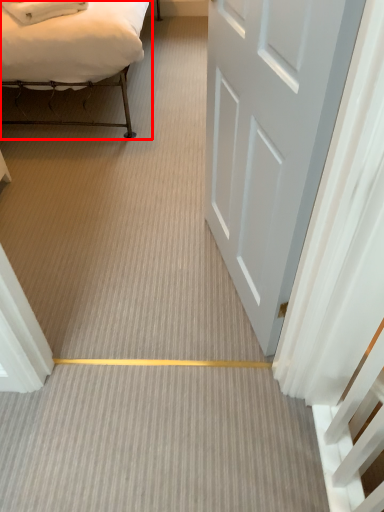
Question: Observing the image, what is the correct spatial positioning of bed (annotated by the red box) in reference to door?

Choices:
 (A) left
 (B) right

Answer: (A)